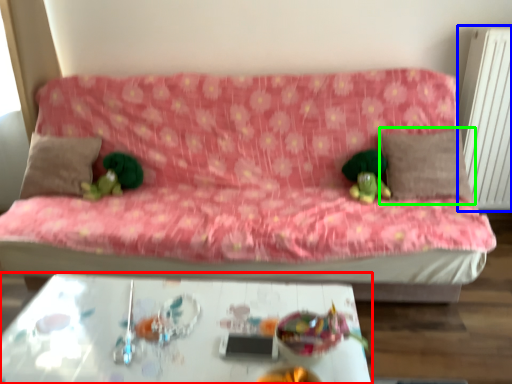
Question: Which object is positioned farthest from table (highlighted by a red box)? Select from radiator (highlighted by a blue box) and pillow (highlighted by a green box).

Choices:
 (A) radiator
 (B) pillow

Answer: (A)